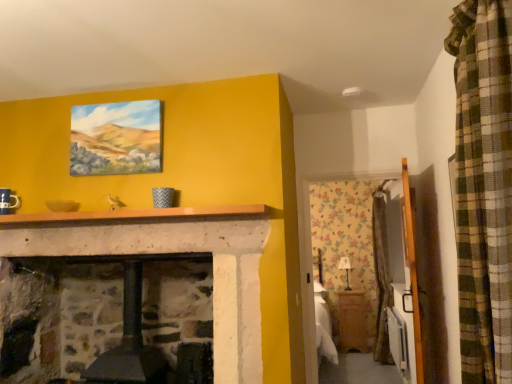
Question: Are matte canvas painting at upper center and wooden armoire at right far apart?

Choices:
 (A) yes
 (B) no

Answer: (A)

Question: Does matte canvas painting at upper center touch wooden armoire at right?

Choices:
 (A) yes
 (B) no

Answer: (B)

Question: Considering the relative sizes of matte canvas painting at upper center and wooden armoire at right in the image provided, is matte canvas painting at upper center shorter than wooden armoire at right?

Choices:
 (A) yes
 (B) no

Answer: (A)

Question: Does matte canvas painting at upper center have a larger size compared to wooden armoire at right?

Choices:
 (A) no
 (B) yes

Answer: (A)

Question: Is matte canvas painting at upper center wider than wooden armoire at right?

Choices:
 (A) no
 (B) yes

Answer: (A)

Question: From a real-world perspective, does matte canvas painting at upper center stand above wooden armoire at right?

Choices:
 (A) yes
 (B) no

Answer: (A)

Question: Does wooden armoire at right turn towards matte canvas painting at upper center?

Choices:
 (A) yes
 (B) no

Answer: (A)

Question: From the image's perspective, does wooden armoire at right appear higher than matte canvas painting at upper center?

Choices:
 (A) no
 (B) yes

Answer: (A)

Question: From the image's perspective, would you say wooden armoire at right is shown under matte canvas painting at upper center?

Choices:
 (A) yes
 (B) no

Answer: (A)

Question: Would you consider wooden armoire at right to be distant from matte canvas painting at upper center?

Choices:
 (A) no
 (B) yes

Answer: (B)

Question: Considering the relative sizes of wooden armoire at right and matte canvas painting at upper center in the image provided, is wooden armoire at right wider than matte canvas painting at upper center?

Choices:
 (A) yes
 (B) no

Answer: (A)

Question: Does wooden armoire at right have a lesser width compared to matte canvas painting at upper center?

Choices:
 (A) yes
 (B) no

Answer: (B)

Question: Is wooden cabinet at lower right to the left of matte canvas painting at upper center from the viewer's perspective?

Choices:
 (A) yes
 (B) no

Answer: (B)